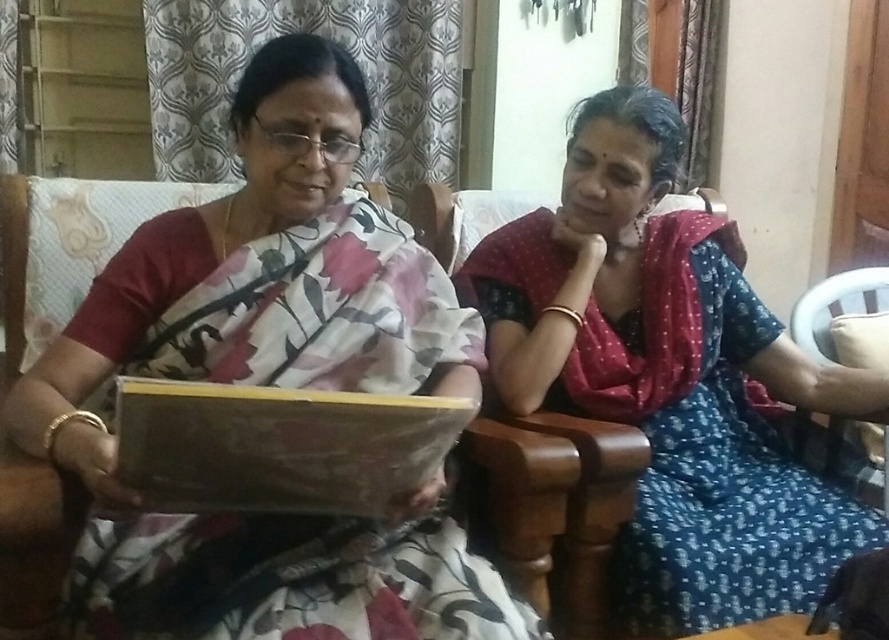
You are taking a photo of two women in a living room. The first woman is at point [247,332] and the second is at point [717,589]. Which woman will appear larger in your photo?

Point [247,332] is closer to the camera than point [717,589], so the woman at point [247,332] will appear larger in the photo.

The two women are sitting on a sofa. The floral silk saree at center is worn by the woman on the left. If the sofa is 1.5 meters long, can both women sit comfortably without overlapping?

The two women are 1.00 meters apart, so they can comfortably sit on the 1.5 meter long sofa without overlapping as the distance between them is less than the sofa length.

You are a fashion designer observing two sarees displayed in a living room. The floral silk saree at center and the blue printed saree at center. Which saree is positioned higher in the image?

The floral silk saree at center is positioned higher than the blue printed saree at center.